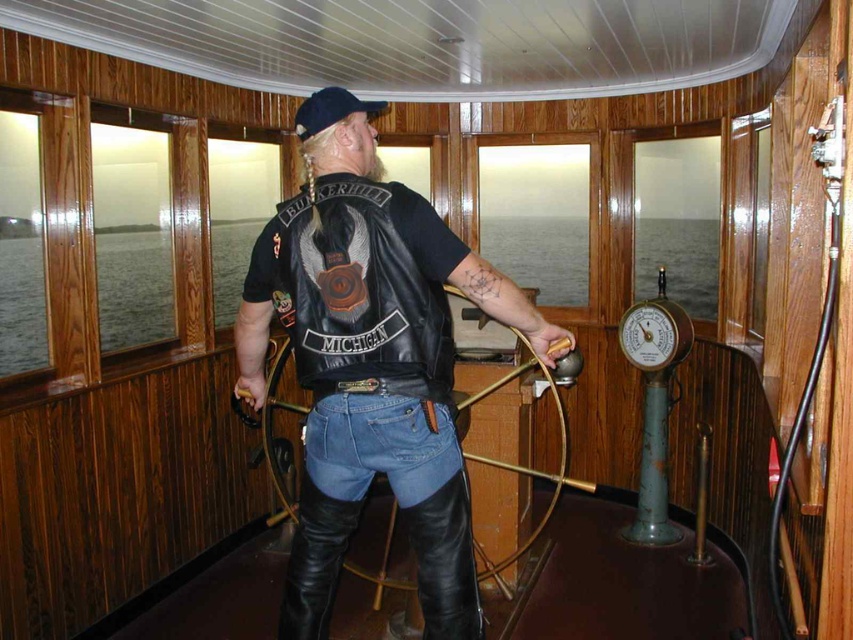
Question: Can you confirm if leather jacket at center is positioned below denim jeans at center?

Choices:
 (A) no
 (B) yes

Answer: (A)

Question: Is leather jacket at center thinner than denim jeans at center?

Choices:
 (A) yes
 (B) no

Answer: (B)

Question: Does leather jacket at center have a greater width compared to denim jeans at center?

Choices:
 (A) yes
 (B) no

Answer: (A)